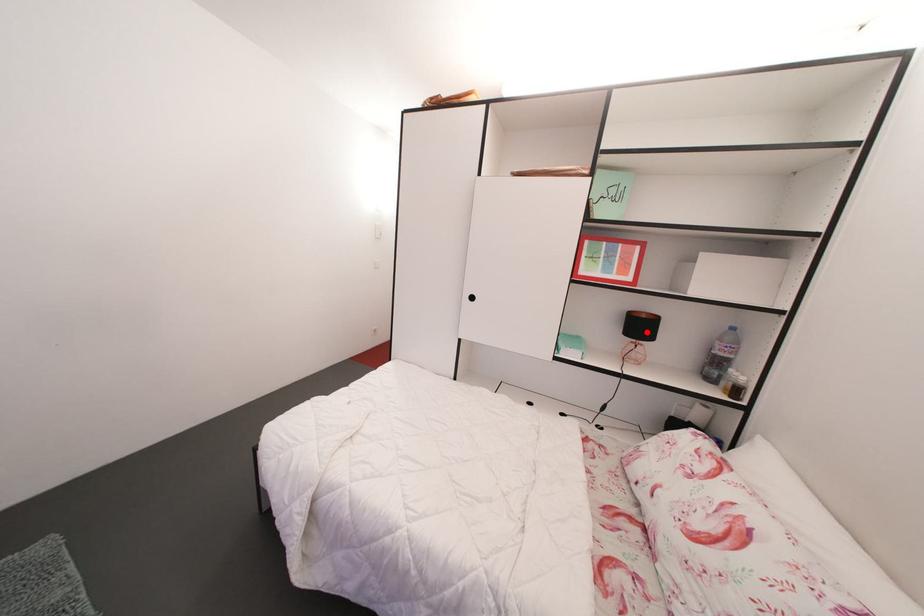
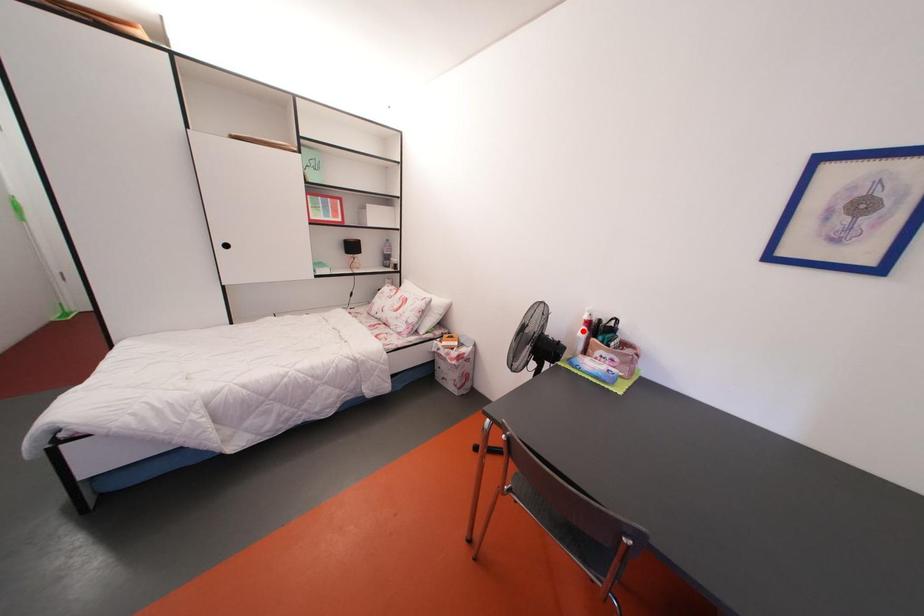
I am providing you with two images of the same scene from different viewpoints. A red point is marked on the first image and another point is marked on the second image. Does the point marked in image1 correspond to the same location as the one in image2?

No